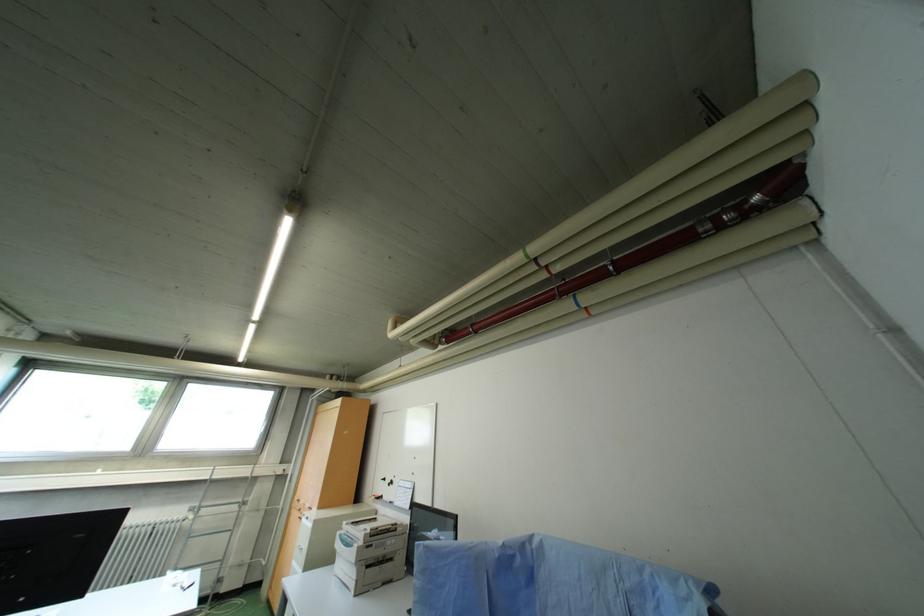
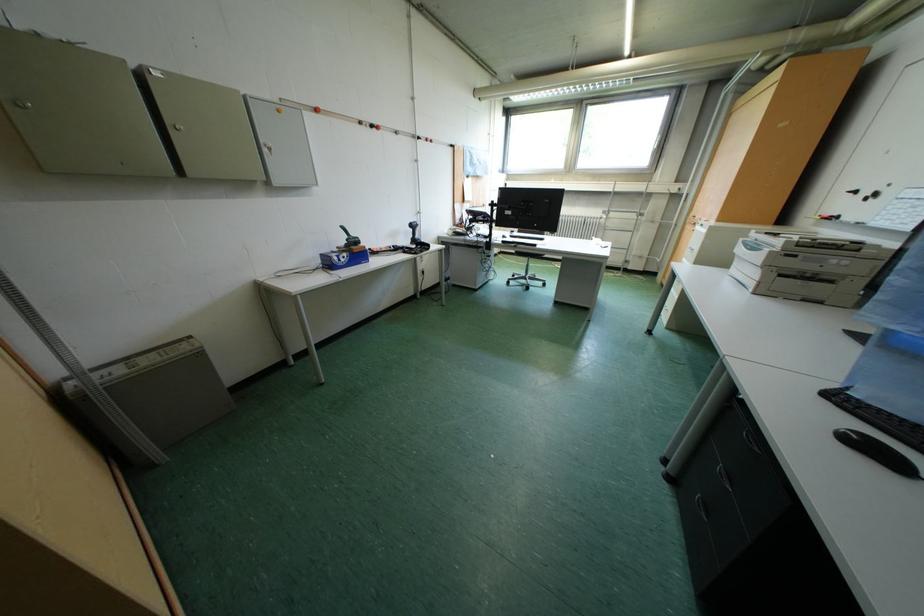
First-person continuous shooting, in which direction is the camera rotating?

The camera's rotation is toward left-down.